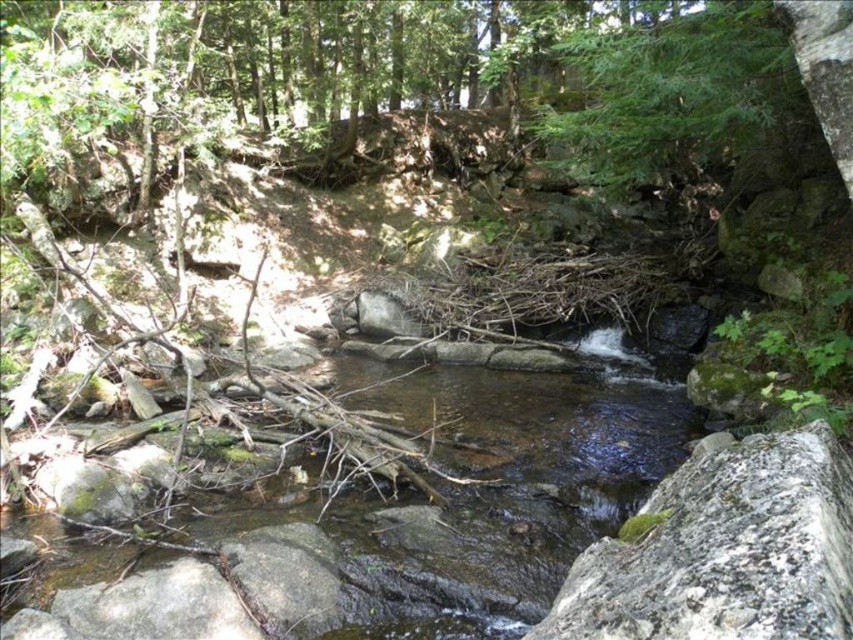
Question: Does green mossy rock at center lie behind green leafy tree at upper right?

Choices:
 (A) no
 (B) yes

Answer: (A)

Question: Does clear water at center have a greater width compared to green leafy tree at upper right?

Choices:
 (A) yes
 (B) no

Answer: (B)

Question: Considering the real-world distances, which object is closest to the green leafy tree at upper right?

Choices:
 (A) green mossy rock at center
 (B) clear water at center

Answer: (A)

Question: Which of these objects is positioned farthest from the green leafy tree at upper right?

Choices:
 (A) clear water at center
 (B) green mossy rock at center

Answer: (A)

Question: Which of the following is the closest to the observer?

Choices:
 (A) clear water at center
 (B) green leafy tree at upper right

Answer: (A)

Question: From the image, what is the correct spatial relationship of green mossy rock at center in relation to green leafy tree at upper right?

Choices:
 (A) above
 (B) below

Answer: (B)